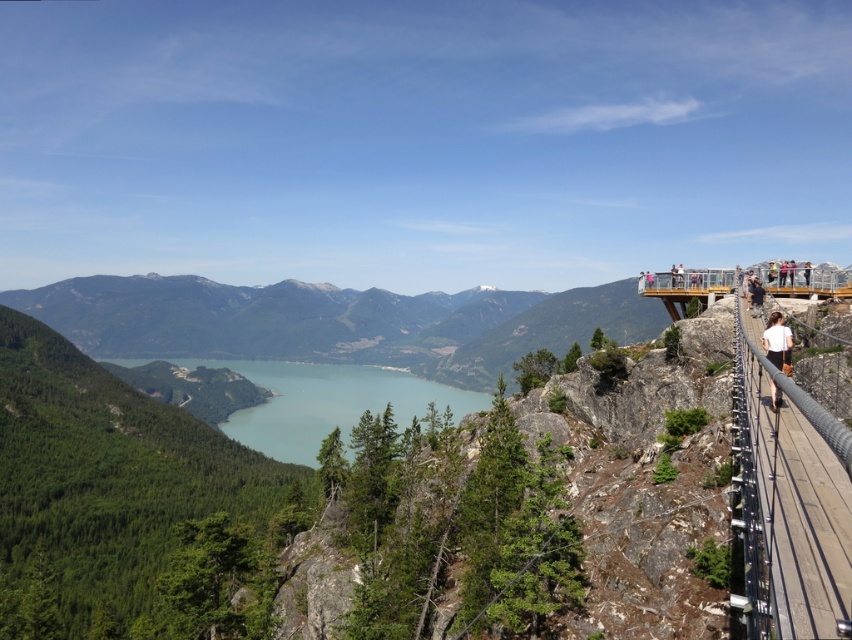
Does point (357, 396) lie in front of point (772, 332)?

No, (357, 396) is behind (772, 332).

Which is behind, point (291, 456) or point (781, 336)?

Positioned behind is point (291, 456).

Is point (296, 368) positioned after point (781, 340)?

Yes, it is.

Where is `blue glassy lake at center`? This screenshot has width=852, height=640. blue glassy lake at center is located at coordinates (327, 403).

Between wooden walkway at right and white cotton shirt at right, which one appears on the right side from the viewer's perspective?

From the viewer's perspective, white cotton shirt at right appears more on the right side.

Between point (772, 365) and point (769, 323), which one is positioned in front?

Point (772, 365) is in front.

Is point (809, 472) closer to camera compared to point (776, 394)?

Yes, point (809, 472) is in front of point (776, 394).

The image size is (852, 640). Identify the location of wooden walkway at right. (790, 502).

Does wooden walkway at right have a larger size compared to blue glassy lake at center?

Actually, wooden walkway at right might be smaller than blue glassy lake at center.

Measure the distance between point [786,481] and camera.

Point [786,481] and camera are 22.92 meters apart.

Is point (806, 616) positioned in front of point (416, 397)?

Yes, point (806, 616) is in front of point (416, 397).

Where is `wooden walkway at right`? Image resolution: width=852 pixels, height=640 pixels. wooden walkway at right is located at coordinates (790, 502).